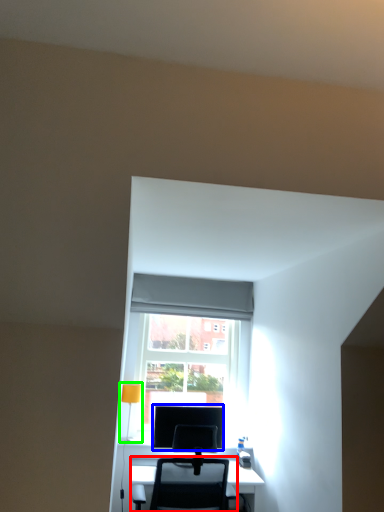
Question: Which object is the farthest from chair (highlighted by a red box)? Choose among these: computer monitor (highlighted by a blue box) or table lamp (highlighted by a green box).

Choices:
 (A) computer monitor
 (B) table lamp

Answer: (B)